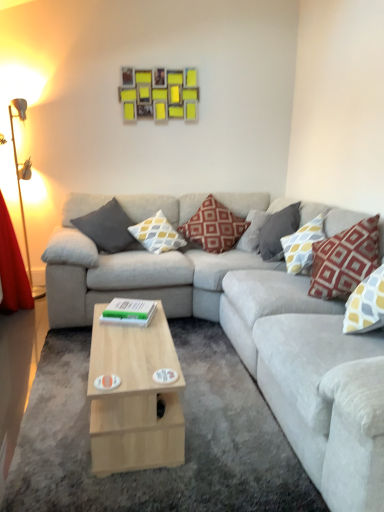
Find the location of `unoccupied region to the right of light wood/wooden coffee table at center`. unoccupied region to the right of light wood/wooden coffee table at center is located at coordinates (227, 416).